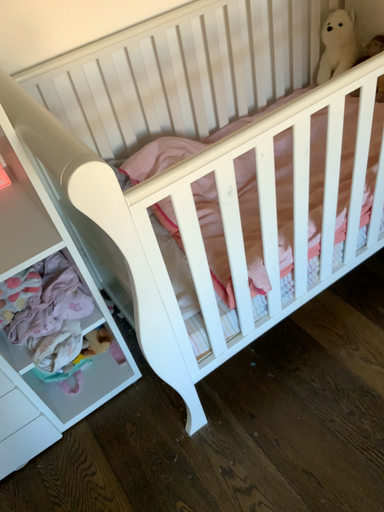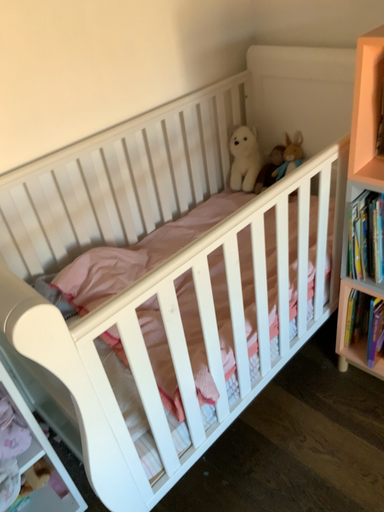
Question: How did the camera likely rotate when shooting the video?

Choices:
 (A) rotated downward
 (B) rotated upward

Answer: (B)